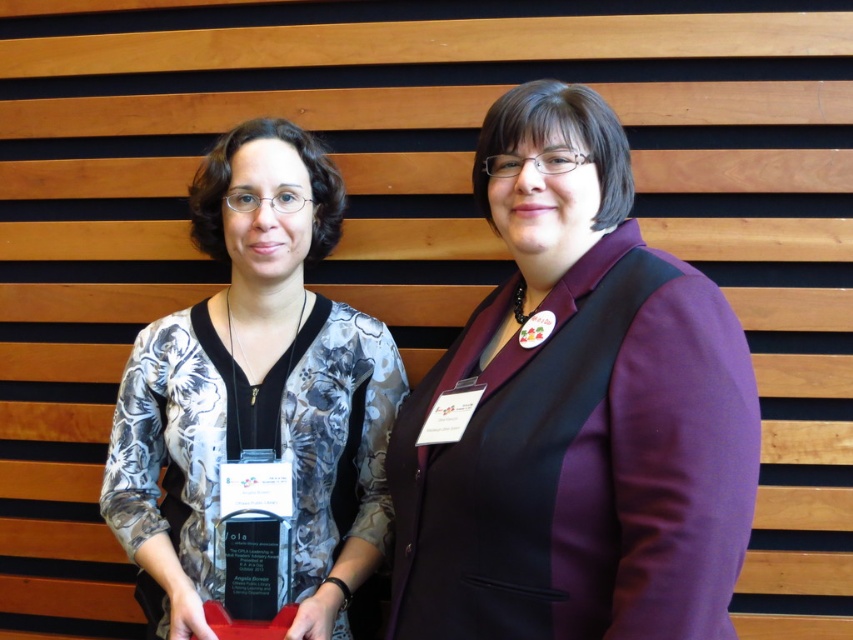
Which is in front, point (689, 378) or point (247, 429)?

Point (689, 378) is in front.

What do you see at coordinates (573, 412) in the screenshot?
I see `purple matte blazer at center` at bounding box center [573, 412].

You are a GUI agent. You are given a task and a screenshot of the screen. Output one action in this format:
    pyautogui.click(x=<x>, y=<y>)
    Task: Click on the purple matte blazer at center
    The width and height of the screenshot is (853, 640).
    Given the screenshot: What is the action you would take?
    pyautogui.click(x=573, y=412)